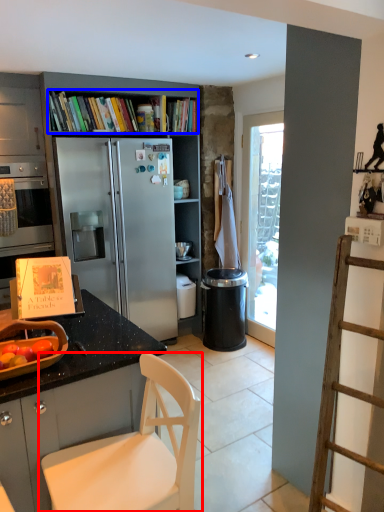
Question: Which of the following is the farthest to the observer, chair (highlighted by a red box) or book (highlighted by a blue box)?

Choices:
 (A) chair
 (B) book

Answer: (B)